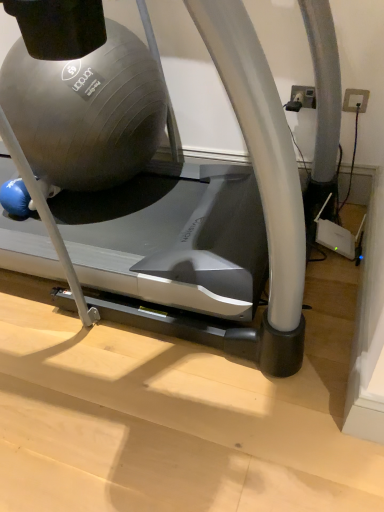
Looking at this image, what is the approximate width of silver metallic treadmill at center?

The width of silver metallic treadmill at center is 3.67 feet.

At what (x,y) coordinates should I click in order to perform the action: click on silver metallic treadmill at center. Please return your answer as a coordinate pair (x, y). This screenshot has height=512, width=384. Looking at the image, I should click on (192, 225).

This screenshot has width=384, height=512. What do you see at coordinates (192, 225) in the screenshot?
I see `silver metallic treadmill at center` at bounding box center [192, 225].

This screenshot has width=384, height=512. I want to click on silver metallic treadmill at center, so click(x=192, y=225).